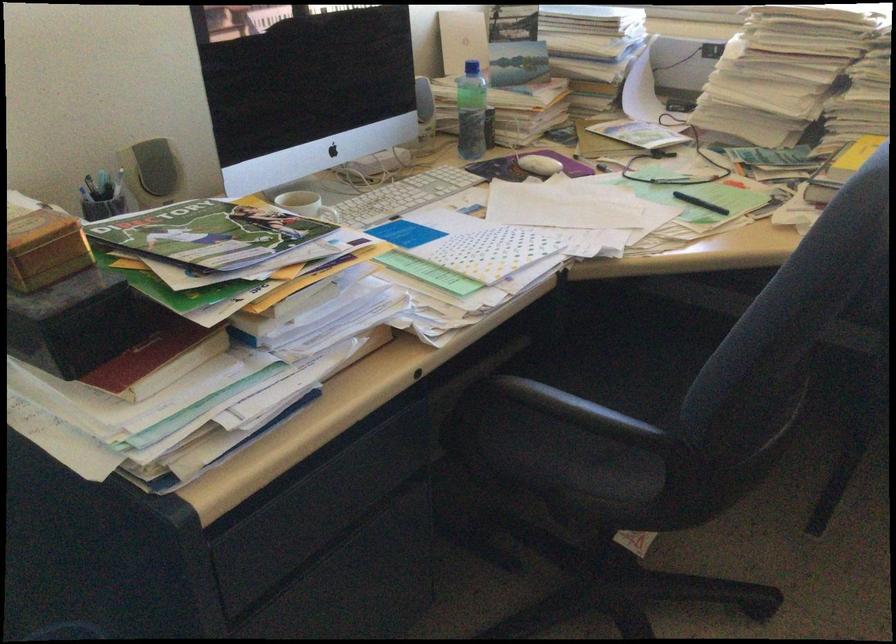
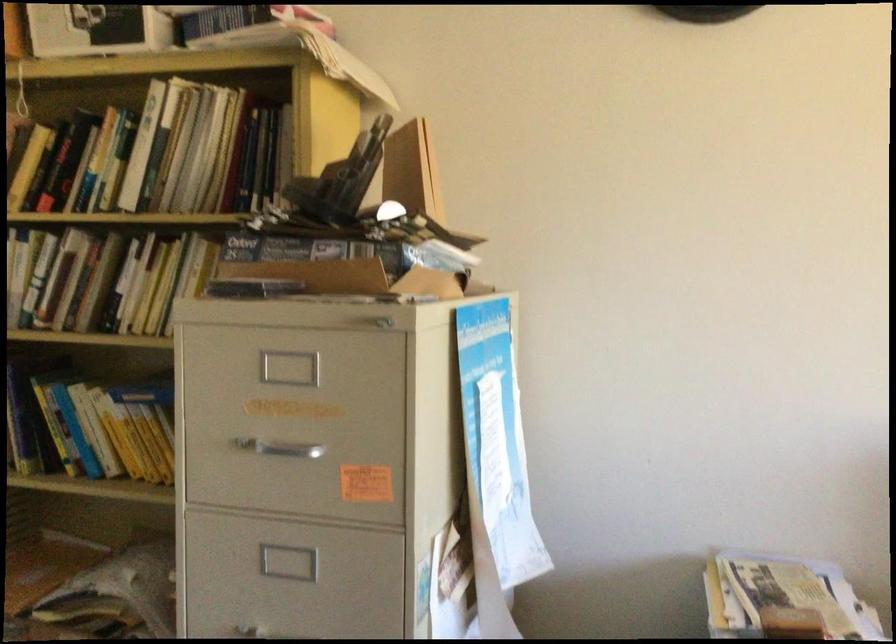
Question: How did the camera likely rotate?

Choices:
 (A) Left
 (B) Right
 (C) Up
 (D) Down

Answer: (A)